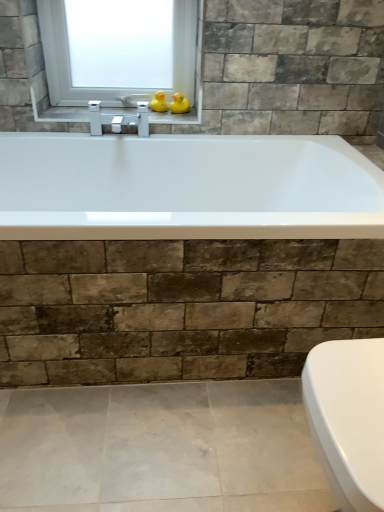
This screenshot has width=384, height=512. In order to click on vacant region to the left of yellow rubber duck at upper center, positioned as the 1th duck in right-to-left order in this screenshot , I will do `click(130, 116)`.